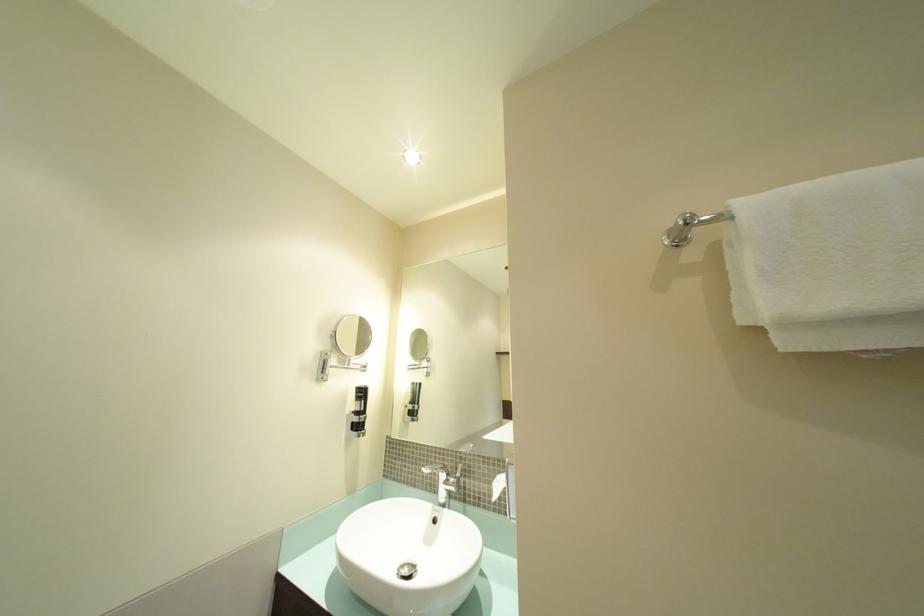
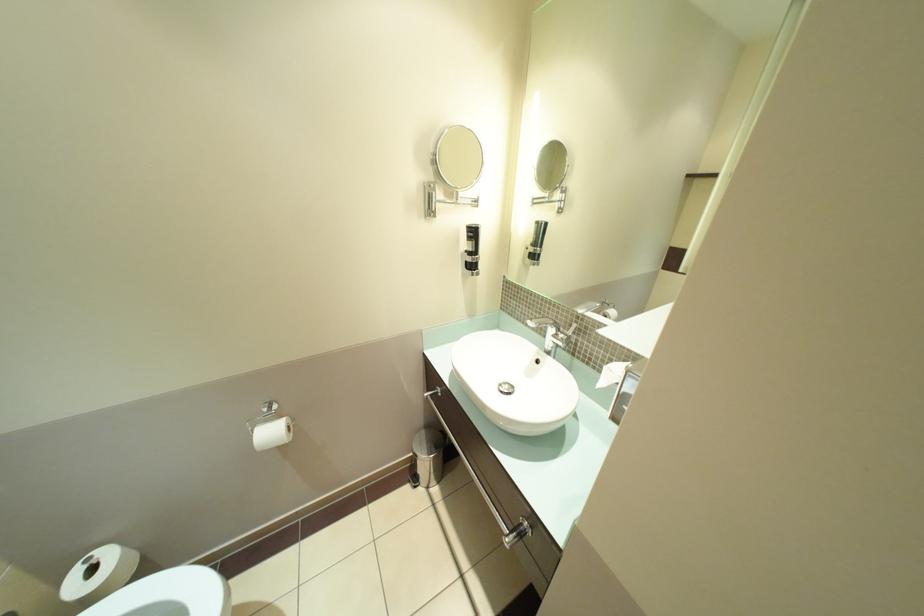
Based on the continuous images, in which direction is the camera rotating?

The rotation direction of the camera is left-down.